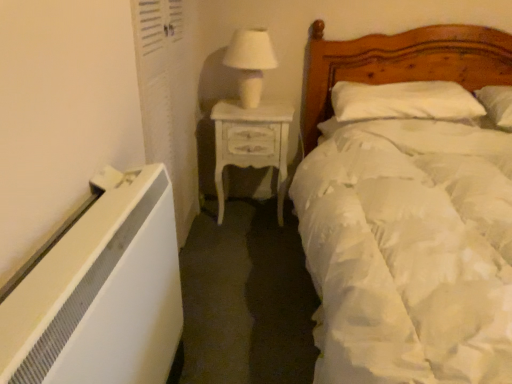
Describe the element at coordinates (250, 62) in the screenshot. I see `white glossy table lamp at upper center` at that location.

Image resolution: width=512 pixels, height=384 pixels. I want to click on white painted wood nightstand at center, so click(x=251, y=142).

Identify the location of white soft pillow at upper right. (404, 101).

Is wooden bed at right smaller than white glossy table lamp at upper center?

No, wooden bed at right is not smaller than white glossy table lamp at upper center.

From the image's perspective, which is below, wooden bed at right or white glossy table lamp at upper center?

From the image's view, wooden bed at right is below.

Is wooden bed at right at the right side of white glossy table lamp at upper center?

Yes.

Does point (328, 139) come farther from viewer compared to point (238, 50)?

No, (328, 139) is closer to viewer.

Consider the image. How many degrees apart are the facing directions of white glossy table lamp at upper center and white soft pillow at upper right?

6.6 degrees separate the facing orientations of white glossy table lamp at upper center and white soft pillow at upper right.

From the image's perspective, which is below, white glossy table lamp at upper center or white soft pillow at upper right?

From the image's view, white soft pillow at upper right is below.

From a real-world perspective, which is physically above, white glossy table lamp at upper center or white soft pillow at upper right?

In real-world perspective, white glossy table lamp at upper center is above.

Is white glossy table lamp at upper center taller or shorter than white soft pillow at upper right?

white glossy table lamp at upper center is taller than white soft pillow at upper right.

Considering the relative sizes of white painted wood nightstand at center and wooden bed at right in the image provided, is white painted wood nightstand at center bigger than wooden bed at right?

Incorrect, white painted wood nightstand at center is not larger than wooden bed at right.

Considering the sizes of objects white painted wood nightstand at center and wooden bed at right in the image provided, who is wider, white painted wood nightstand at center or wooden bed at right?

wooden bed at right.

Which of these two, white painted wood nightstand at center or wooden bed at right, stands shorter?

Standing shorter between the two is white painted wood nightstand at center.

From the picture: From a real-world perspective, is white painted wood nightstand at center positioned under wooden bed at right based on gravity?

Yes, from a real-world perspective, white painted wood nightstand at center is under wooden bed at right.

In the scene shown: From a real-world perspective, does white glossy table lamp at upper center sit lower than wooden bed at right?

Incorrect, from a real-world perspective, white glossy table lamp at upper center is higher than wooden bed at right.

How different are the orientations of white glossy table lamp at upper center and wooden bed at right in degrees?

white glossy table lamp at upper center and wooden bed at right are facing 5.65 degrees away from each other.

From the image's perspective, is white glossy table lamp at upper center on top of wooden bed at right?

Yes, from the image's perspective, white glossy table lamp at upper center is on top of wooden bed at right.

Does point (252, 81) come behind point (464, 269)?

Yes, it is behind point (464, 269).

Which object is positioned more to the right, white soft pillow at upper right or white painted wood nightstand at center?

Positioned to the right is white soft pillow at upper right.

Are white soft pillow at upper right and white painted wood nightstand at center far apart?

white soft pillow at upper right is near white painted wood nightstand at center, not far away.

Considering the relative positions of white soft pillow at upper right and white painted wood nightstand at center in the image provided, is white soft pillow at upper right behind white painted wood nightstand at center?

No.

What's the angular difference between white soft pillow at upper right and white painted wood nightstand at center's facing directions?

They differ by 0.749 degrees in their facing directions.

Is white painted wood nightstand at center looking in the opposite direction of white soft pillow at upper right?

No, white soft pillow at upper right is not at the back of white painted wood nightstand at center.

Which of these two, white painted wood nightstand at center or white soft pillow at upper right, is wider?

Wider between the two is white soft pillow at upper right.

Does white painted wood nightstand at center appear on the left side of white soft pillow at upper right?

Correct, you'll find white painted wood nightstand at center to the left of white soft pillow at upper right.

Is white painted wood nightstand at center far from white soft pillow at upper right?

No, white painted wood nightstand at center is in close proximity to white soft pillow at upper right.

Is white painted wood nightstand at center positioned far away from white glossy table lamp at upper center?

No, white painted wood nightstand at center is not far from white glossy table lamp at upper center.

From the picture: Which object is more forward, white painted wood nightstand at center or white glossy table lamp at upper center?

white glossy table lamp at upper center is in front.

How different are the orientations of white painted wood nightstand at center and white glossy table lamp at upper center in degrees?

5.86 degrees separate the facing orientations of white painted wood nightstand at center and white glossy table lamp at upper center.

Which is farther, (221, 179) or (245, 90)?

Positioned behind is point (221, 179).

In the image, there is a white glossy table lamp at upper center. Identify the location of bed below it (from the image's perspective). The width and height of the screenshot is (512, 384). (408, 214).

The width and height of the screenshot is (512, 384). In the image, there is a white glossy table lamp at upper center. What are the coordinates of `pillow below it (from a real-world perspective)` in the screenshot? It's located at (404, 101).

When comparing their distances from white painted wood nightstand at center, does wooden bed at right or white glossy table lamp at upper center seem further?

Among the two, wooden bed at right is located further to white painted wood nightstand at center.

Estimate the real-world distances between objects in this image. Which object is closer to white soft pillow at upper right, wooden bed at right or white glossy table lamp at upper center?

wooden bed at right.

Estimate the real-world distances between objects in this image. Which object is closer to white painted wood nightstand at center, white soft pillow at upper right or white glossy table lamp at upper center?

white glossy table lamp at upper center lies closer to white painted wood nightstand at center than the other object.

Considering their positions, is white painted wood nightstand at center positioned further to white soft pillow at upper right than wooden bed at right?

white painted wood nightstand at center is further to white soft pillow at upper right.

Which object lies further to the anchor point white soft pillow at upper right, white glossy table lamp at upper center or white painted wood nightstand at center?

The object further to white soft pillow at upper right is white glossy table lamp at upper center.

Estimate the real-world distances between objects in this image. Which object is closer to white glossy table lamp at upper center, white soft pillow at upper right or white painted wood nightstand at center?

white painted wood nightstand at center is positioned closer to the anchor white glossy table lamp at upper center.

Based on their spatial positions, is white glossy table lamp at upper center or white painted wood nightstand at center further from wooden bed at right?

white glossy table lamp at upper center.

Looking at the image, which one is located further to white painted wood nightstand at center, white glossy table lamp at upper center or wooden bed at right?

Based on the image, wooden bed at right appears to be further to white painted wood nightstand at center.

What are the coordinates of `pillow between wooden bed at right and white glossy table lamp at upper center along the z-axis` in the screenshot? It's located at (404, 101).

Where is `nightstand between white glossy table lamp at upper center and white soft pillow at upper right`? nightstand between white glossy table lamp at upper center and white soft pillow at upper right is located at coordinates (251, 142).

Locate an element on the screen. The image size is (512, 384). pillow between wooden bed at right and white painted wood nightstand at center from front to back is located at coordinates (404, 101).

Where is `table lamp between wooden bed at right and white painted wood nightstand at center from front to back`? table lamp between wooden bed at right and white painted wood nightstand at center from front to back is located at coordinates (250, 62).